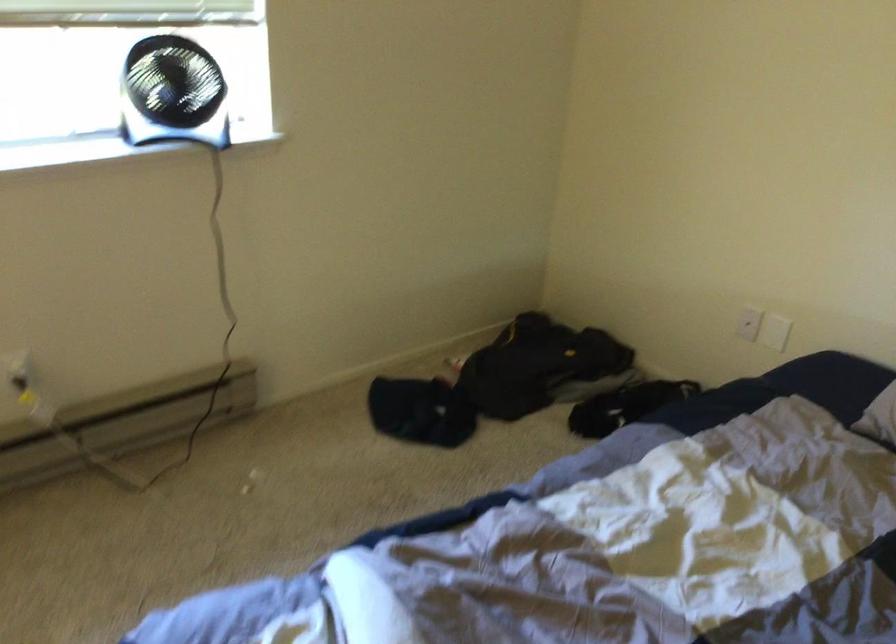
Question: Based on the continuous images, in which direction is the camera rotating? Reply with the corresponding letter.

Choices:
 (A) Left
 (B) Right
 (C) Up
 (D) Down

Answer: (A)